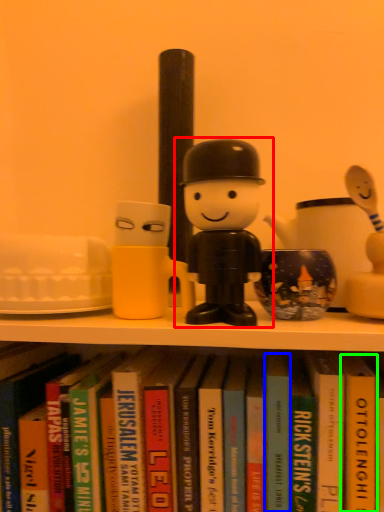
Question: Which object is positioned closest to toy (highlighted by a red box)? Select from paperback book (highlighted by a blue box) and paperback book (highlighted by a green box).

Choices:
 (A) paperback book
 (B) paperback book

Answer: (A)